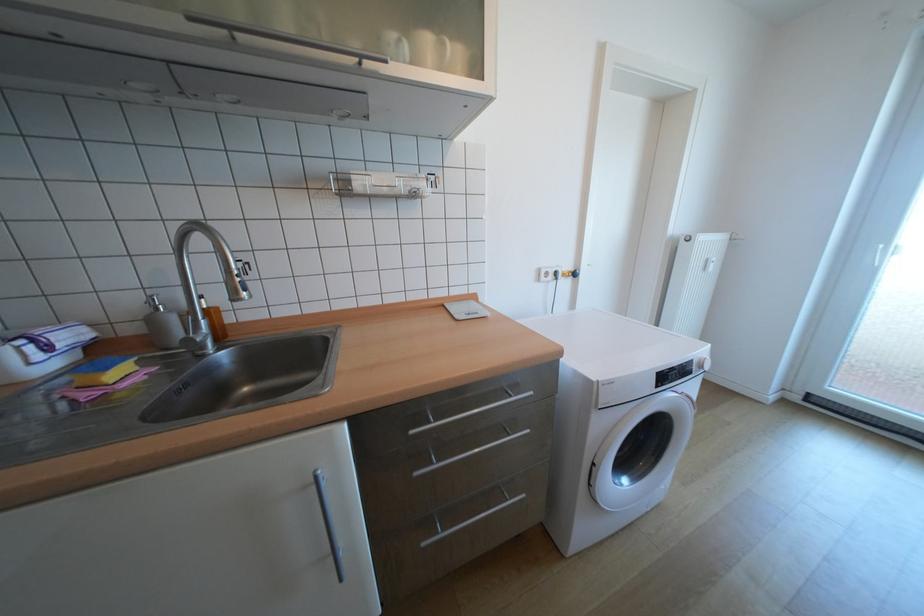
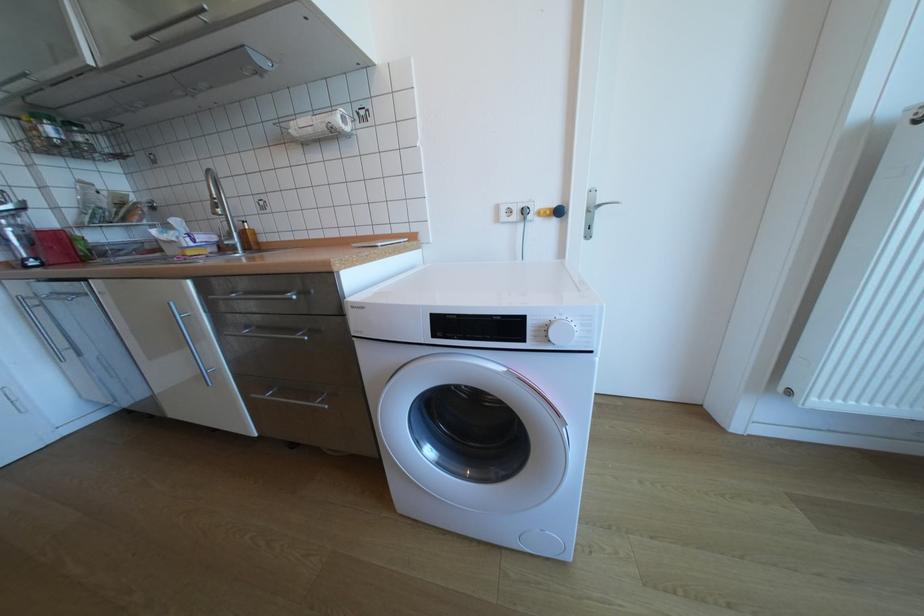
Where in the second image is the point corresponding to the point at 418,188 from the first image?

(334, 124)